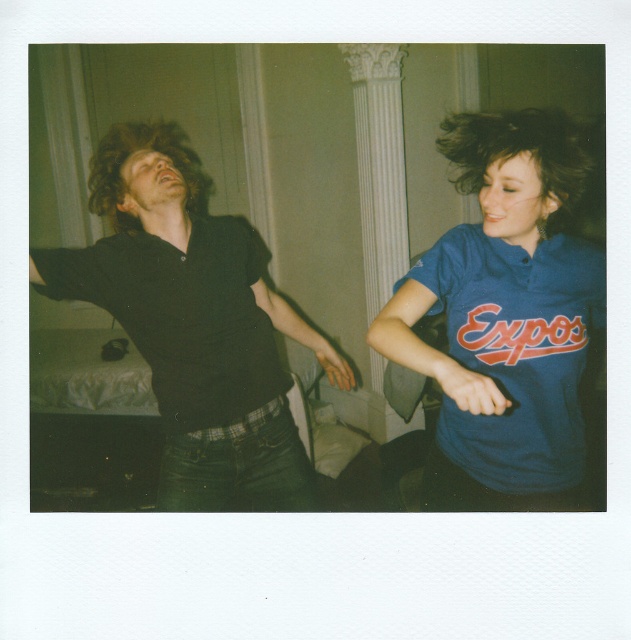
Question: Among these objects, which one is nearest to the camera?

Choices:
 (A) curly brown hair at left
 (B) dark brown silky hair at upper right
 (C) blue jersey at center
 (D) matte black shirt at left

Answer: (C)

Question: Estimate the real-world distances between objects in this image. Which object is farther from the dark brown silky hair at upper right?

Choices:
 (A) matte black shirt at left
 (B) curly brown hair at left

Answer: (B)

Question: Is blue jersey at center thinner than matte black shirt at left?

Choices:
 (A) no
 (B) yes

Answer: (B)

Question: Can you confirm if matte black shirt at left is wider than curly brown hair at left?

Choices:
 (A) yes
 (B) no

Answer: (A)

Question: Which object is closer to the camera taking this photo?

Choices:
 (A) blue jersey at center
 (B) dark brown silky hair at upper right

Answer: (A)

Question: In this image, where is blue jersey at center located relative to matte black shirt at left?

Choices:
 (A) above
 (B) below

Answer: (A)